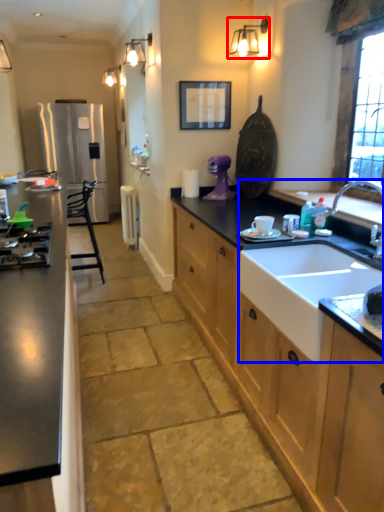
Question: Which of the following is the closest to the observer, light fixture (highlighted by a red box) or sink (highlighted by a blue box)?

Choices:
 (A) light fixture
 (B) sink

Answer: (B)